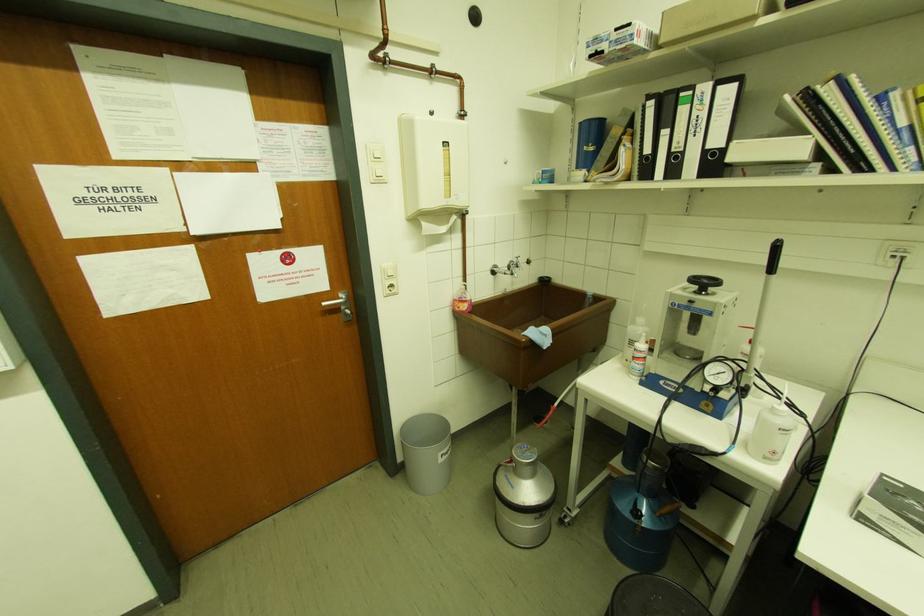
Where is `grey trash can`? grey trash can is located at coordinates (427, 453).